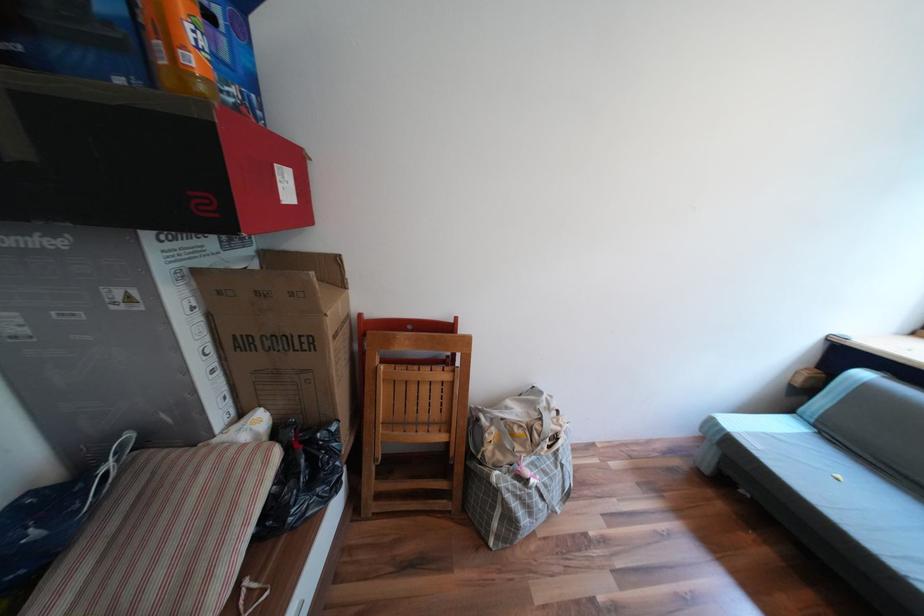
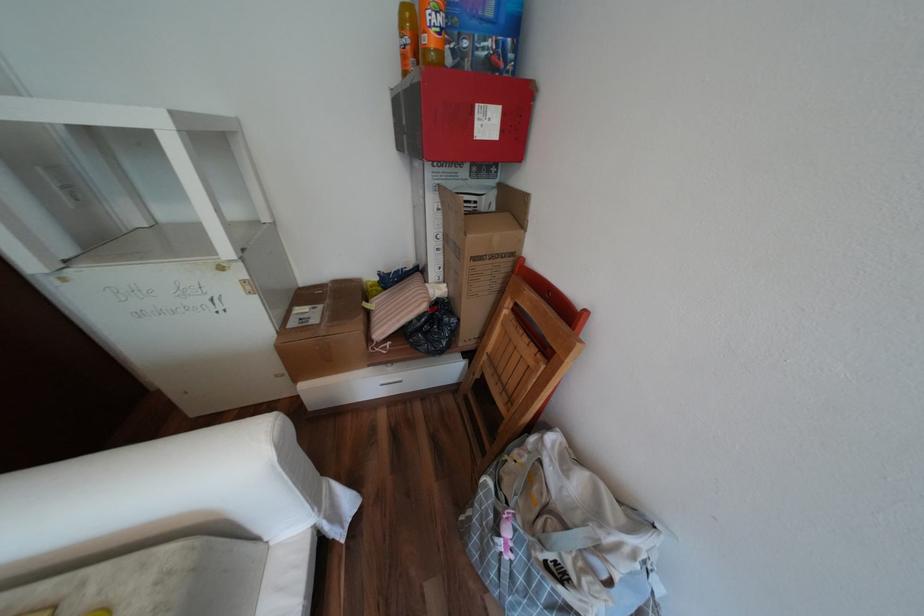
The first image is from the beginning of the video and the second image is from the end. How did the camera likely rotate when shooting the video?

The camera's rotation is toward left-down.